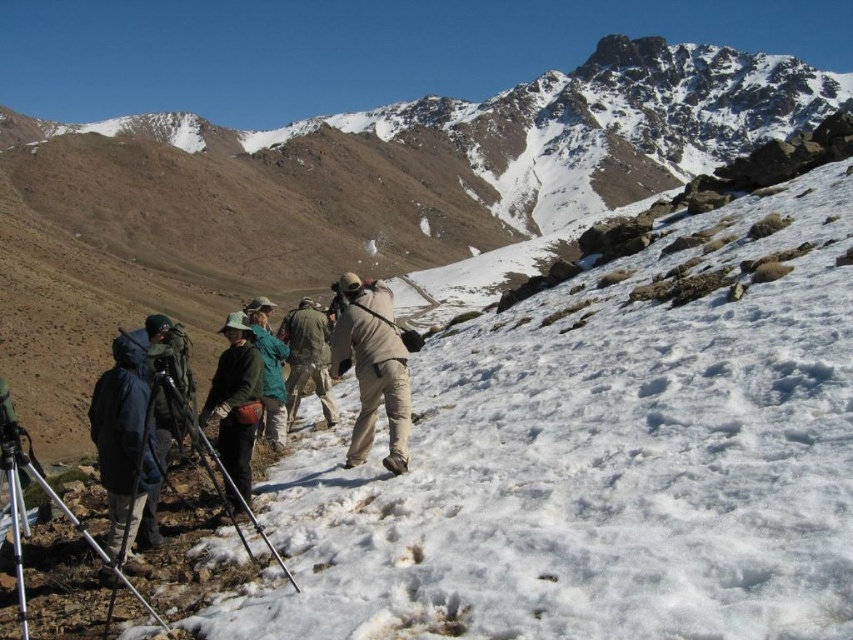
You are a photographer standing at the bottom of the slope and want to capture both the dark blue fabric jacket at lower left and the green fabric jacket at center in your shot. Which jacket will appear taller in the photo?

The dark blue fabric jacket at lower left will appear taller in the photo because it has a greater height compared to the green fabric jacket at center.

You are a hiker looking at the snowy slope and see the dark blue fabric jacket at lower left and the green fabric jacket at center. Which hiker is higher up the slope?

The dark blue fabric jacket at lower left is located above the green fabric jacket at center, so the hiker in the dark blue fabric jacket at lower left is higher up the slope.